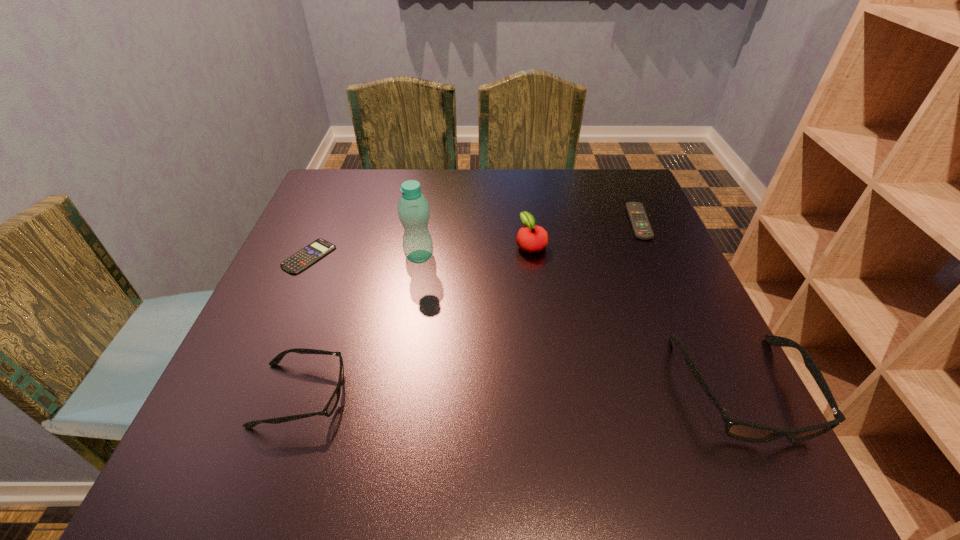
Where is `object situated at the near right corner`? The height and width of the screenshot is (540, 960). object situated at the near right corner is located at coordinates (738, 429).

I want to click on free space at the far edge, so click(x=502, y=215).

In the image, there is a desktop. Where is `vacant space at the near edge`? The height and width of the screenshot is (540, 960). vacant space at the near edge is located at coordinates (548, 395).

What are the coordinates of `free region at the left edge of the desktop` in the screenshot? It's located at (334, 292).

In the image, there is a desktop. Where is `free space at the right edge`? This screenshot has width=960, height=540. free space at the right edge is located at coordinates (684, 287).

I want to click on vacant space at the far left corner, so click(352, 195).

In the image, there is a desktop. In order to click on free region at the near right corner in this screenshot , I will do `click(672, 385)`.

Find the location of a particular element. This screenshot has height=540, width=960. free area in between the second shortest object and the right spectacles is located at coordinates (690, 305).

Locate an element on the screen. The width and height of the screenshot is (960, 540). vacant space in between the calculator and the remote control is located at coordinates (474, 239).

Identify the location of vacant region between the tallest object and the third object from right to left. Image resolution: width=960 pixels, height=540 pixels. (475, 251).